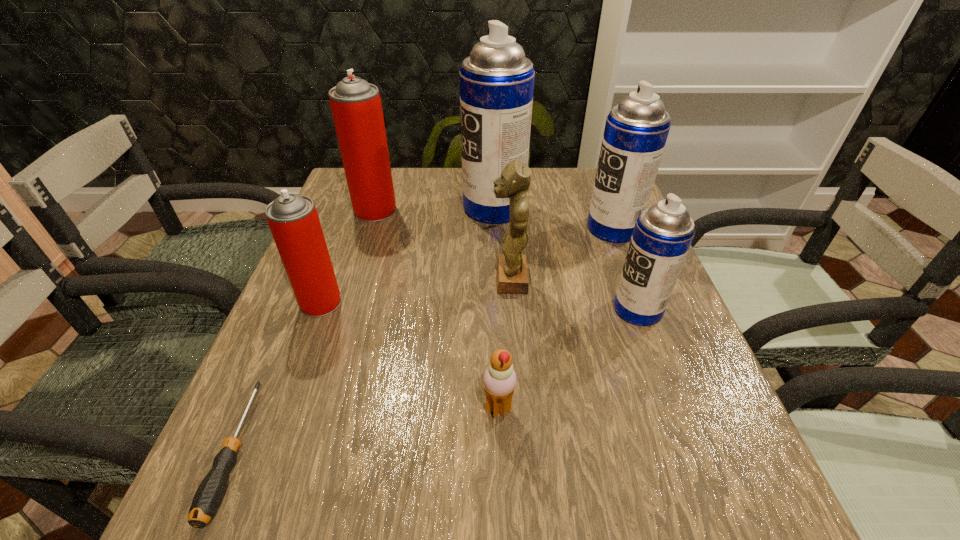
Image resolution: width=960 pixels, height=540 pixels. I want to click on unoccupied area between the smallest blue aerosol can and the nearer red aerosol can, so (479, 306).

The image size is (960, 540). Find the location of `unoccupied position between the smallest blue aerosol can and the icecream`. unoccupied position between the smallest blue aerosol can and the icecream is located at coordinates (568, 359).

The height and width of the screenshot is (540, 960). I want to click on free space between the tallest aerosol can and the shortest object, so click(x=365, y=329).

In order to click on free spot between the second shortest object and the third aerosol can from right to left in this screenshot , I will do `click(496, 308)`.

Point out which object is positioned as the seventh nearest to the second biggest blue aerosol can. Please provide its 2D coordinates. Your answer should be formatted as a tuple, i.e. [(x, y)], where the tuple contains the x and y coordinates of a point satisfying the conditions above.

[(209, 494)]

This screenshot has width=960, height=540. What are the coordinates of `the seventh closest object to the bigger red aerosol can` in the screenshot? It's located at (499, 380).

Locate an element on the screen. This screenshot has width=960, height=540. the third closest aerosol can to the icecream is located at coordinates (636, 130).

Identify the location of the third closest aerosol can to the seventh tallest object. The width and height of the screenshot is (960, 540). (636, 130).

Image resolution: width=960 pixels, height=540 pixels. I want to click on blue aerosol can that is the third closest to the farther red aerosol can, so click(x=662, y=235).

The image size is (960, 540). Identify the location of blue aerosol can that is the second closest to the bigger red aerosol can. (636, 130).